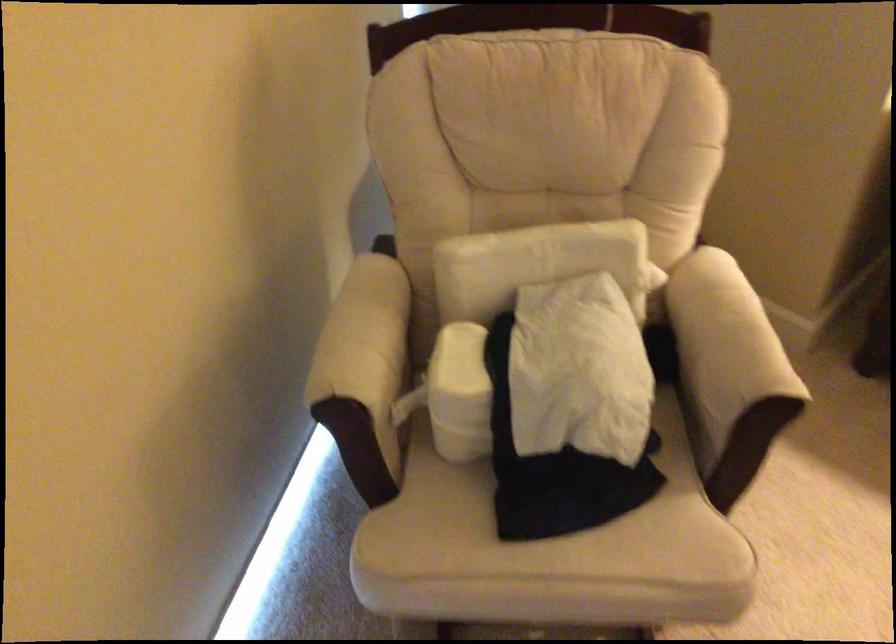
The height and width of the screenshot is (644, 896). What do you see at coordinates (545, 535) in the screenshot? I see `the chair sitting surface` at bounding box center [545, 535].